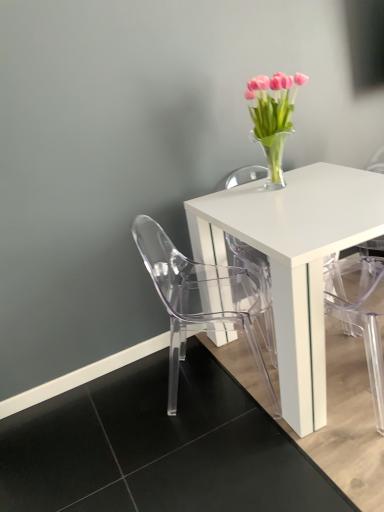
What are the coordinates of `vacant region to the right of pink glass vase at upper right` in the screenshot? It's located at (317, 176).